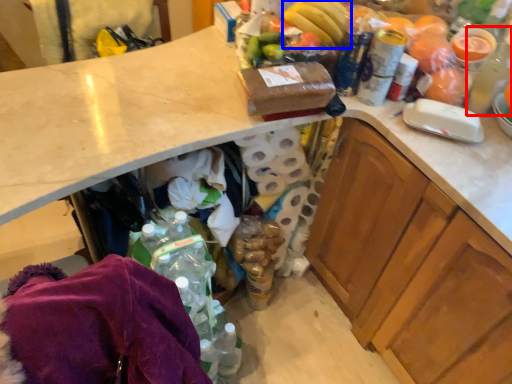
Question: Among these objects, which one is farthest to the camera, bottle (highlighted by a red box) or banana (highlighted by a blue box)?

Choices:
 (A) bottle
 (B) banana

Answer: (B)